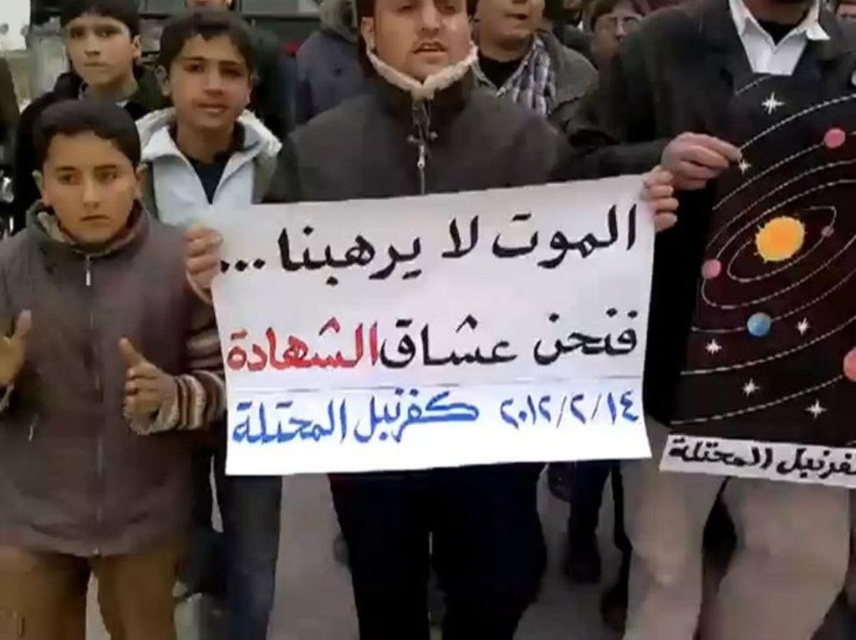
Can you confirm if dark brown sweater at center is smaller than matte black sign at center?

Actually, dark brown sweater at center might be larger than matte black sign at center.

The width and height of the screenshot is (856, 640). Find the location of `dark brown sweater at center`. dark brown sweater at center is located at coordinates (738, 301).

Image resolution: width=856 pixels, height=640 pixels. In order to click on dark brown sweater at center in this screenshot , I will do pos(738,301).